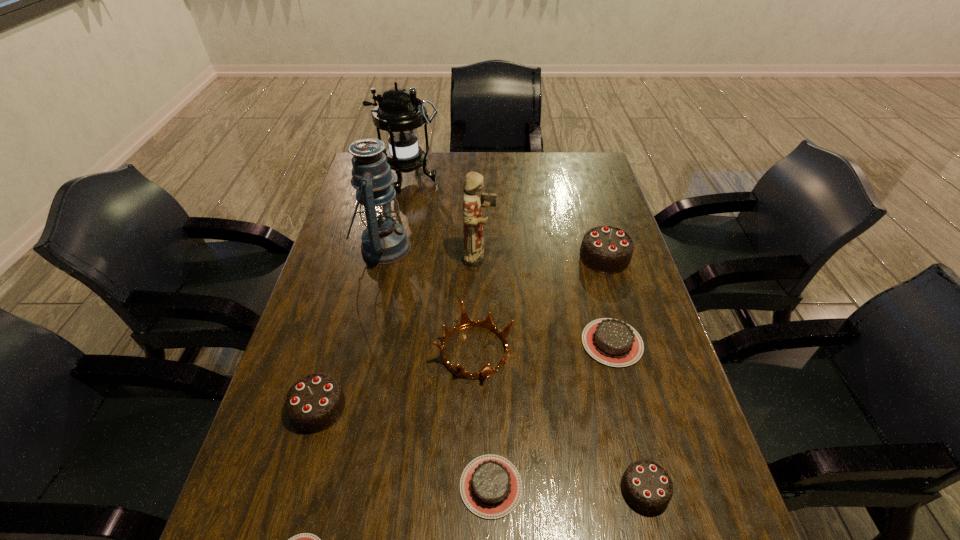
You are a GUI agent. You are given a task and a screenshot of the screen. Output one action in this format:
    pyautogui.click(x=<x>, y=<y>)
    Task: Click on the vacant space located 0.320m on the right of the crown
    This screenshot has width=960, height=540.
    Given the screenshot: What is the action you would take?
    pyautogui.click(x=644, y=351)

Identify the location of vacant space located on the right of the third tallest chocolate cake. (709, 489).

Identify the location of blank space located on the back of the second farthest chocolate cake. Image resolution: width=960 pixels, height=540 pixels. (596, 281).

The height and width of the screenshot is (540, 960). What are the coordinates of `free location located 0.350m on the left of the second farthest brown chocolate cake` in the screenshot? It's located at (279, 486).

Identify the location of object at the far edge. The image size is (960, 540). (399, 113).

Identify the location of chocolate cake located at the left edge. (315, 402).

Where is `object situated at the far left corner`? object situated at the far left corner is located at coordinates (399, 113).

Where is `vacant space at the far edge of the desktop`? vacant space at the far edge of the desktop is located at coordinates (543, 156).

In the image, there is a desktop. Where is `vacant space at the left edge`? Image resolution: width=960 pixels, height=540 pixels. vacant space at the left edge is located at coordinates (357, 292).

The image size is (960, 540). In the image, there is a desktop. What are the coordinates of `vacant space at the right edge` in the screenshot? It's located at (612, 296).